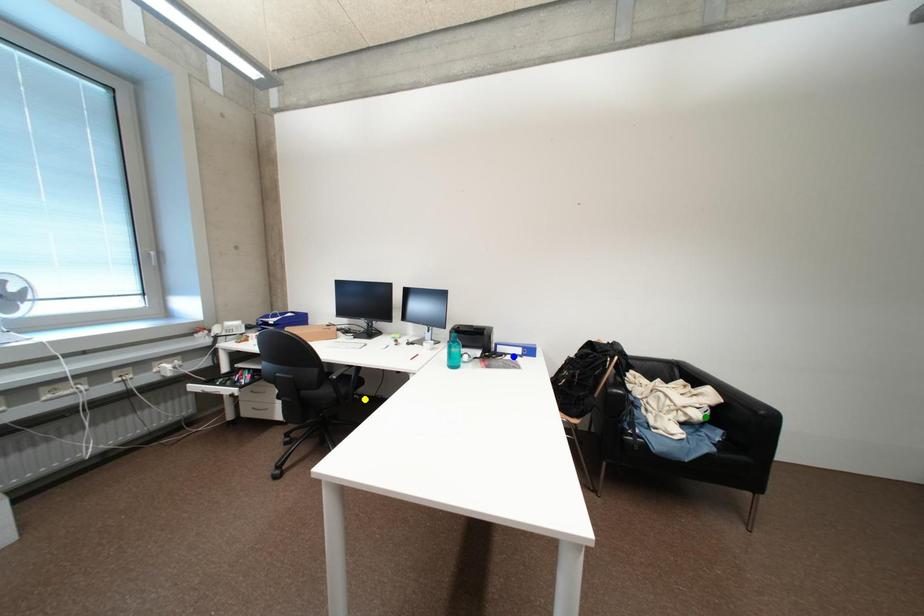
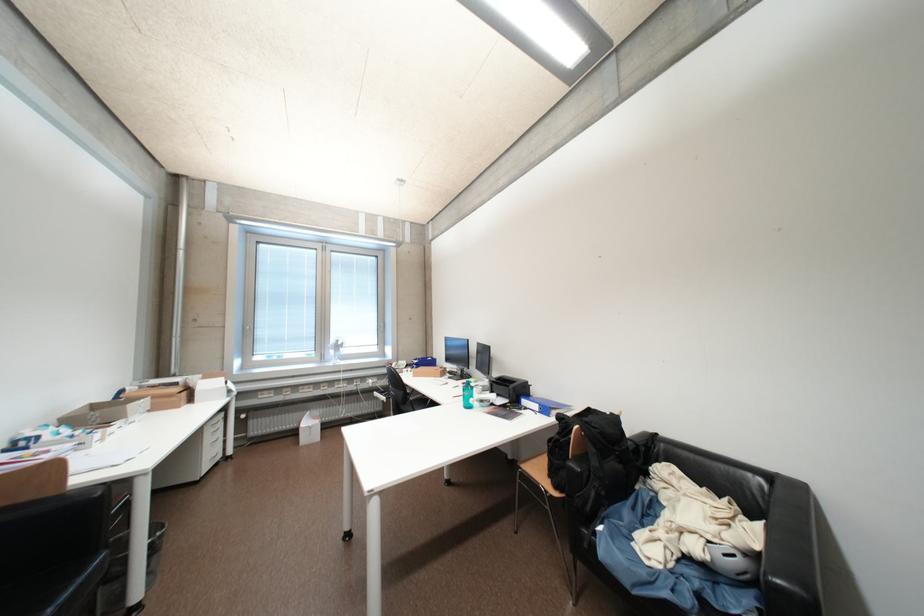
I am providing you with two images of the same scene from different viewpoints. Three points are marked in image1. Which point corresponds to a part or object that is occluded in image2?In image1, three points are marked. Which of them correspond to a part or object that is occluded in image2?Among the three points shown in image1, which one corresponds to a part or object that is no longer visible due to occlusion in image2?

yellow point